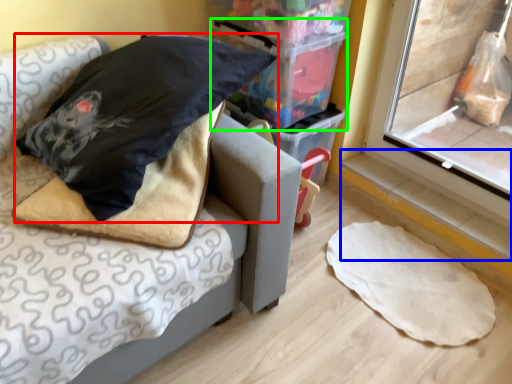
Question: Which is nearer to the pillow (highlighted by a red box)? window sill (highlighted by a blue box) or storage box (highlighted by a green box).

Choices:
 (A) window sill
 (B) storage box

Answer: (B)